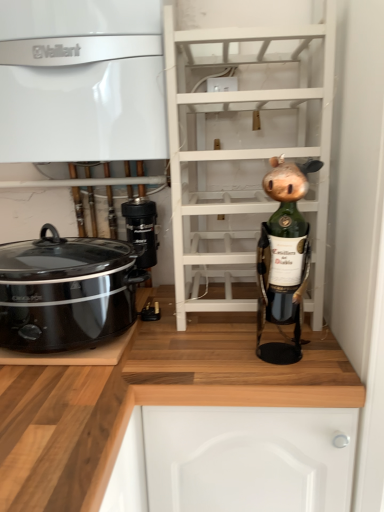
This screenshot has width=384, height=512. Find the location of `vacant region in front of white wooden shelf at center`. vacant region in front of white wooden shelf at center is located at coordinates (238, 358).